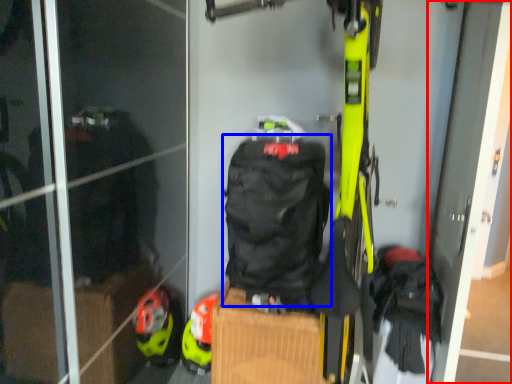
Question: Which object is closer to the camera taking this photo, screen door (highlighted by a red box) or backpack (highlighted by a blue box)?

Choices:
 (A) screen door
 (B) backpack

Answer: (A)